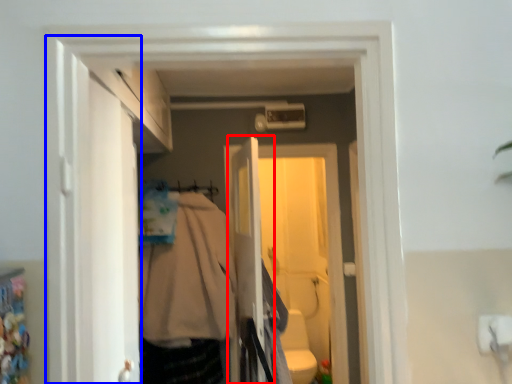
Question: Which point is closer to the camera, screen door (highlighted by a red box) or door (highlighted by a blue box)?

Choices:
 (A) screen door
 (B) door

Answer: (B)